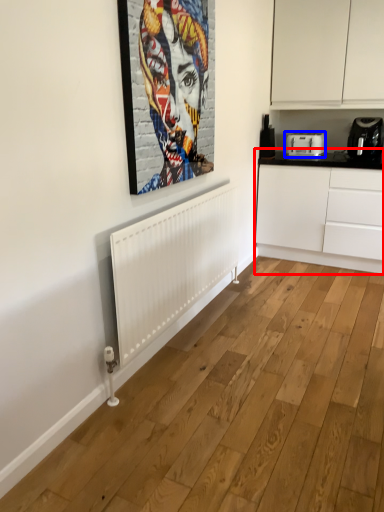
Question: Which object is closer to the camera taking this photo, cabinetry (highlighted by a red box) or toaster (highlighted by a blue box)?

Choices:
 (A) cabinetry
 (B) toaster

Answer: (A)